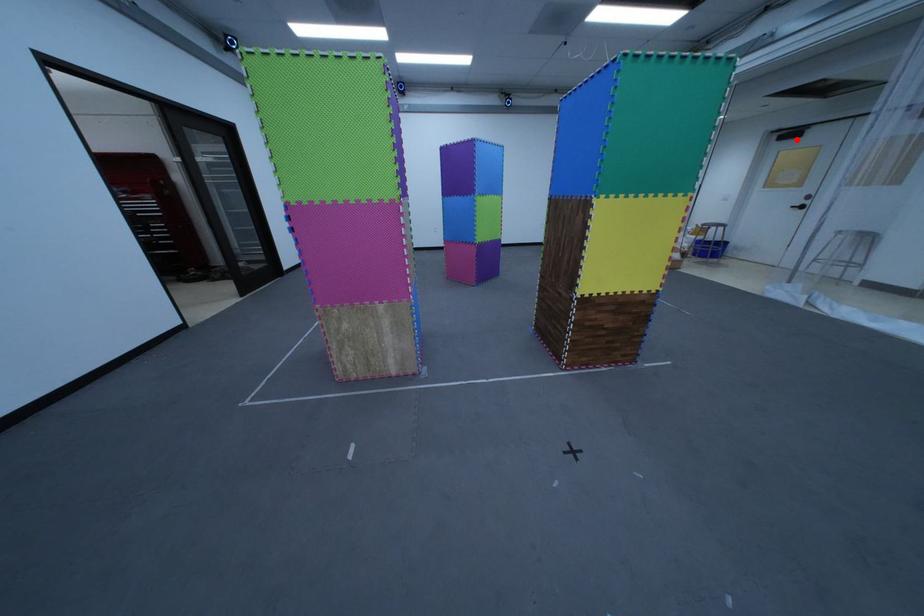
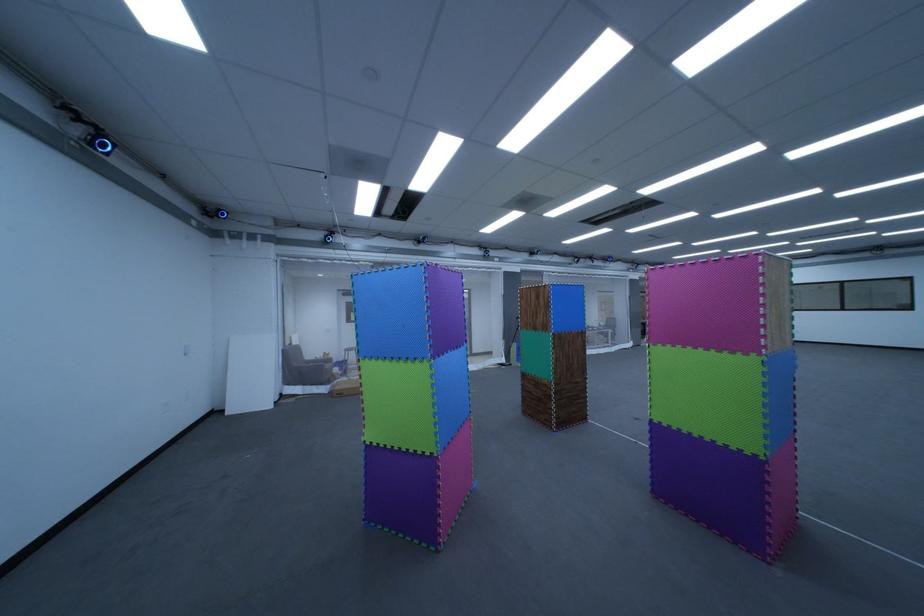
Locate, in the second image, the point that corresponds to the highlighted location in the first image.

(359, 296)